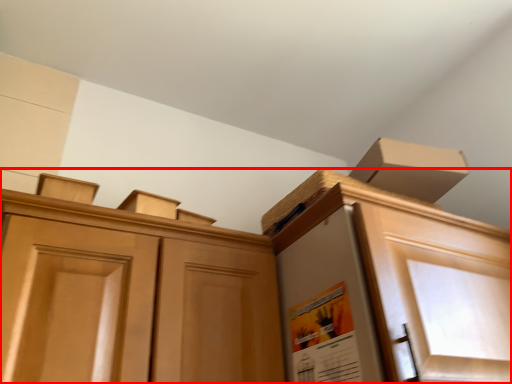
Question: Observing the image, what is the correct spatial positioning of cabinetry (annotated by the red box) in reference to poster?

Choices:
 (A) left
 (B) right

Answer: (A)